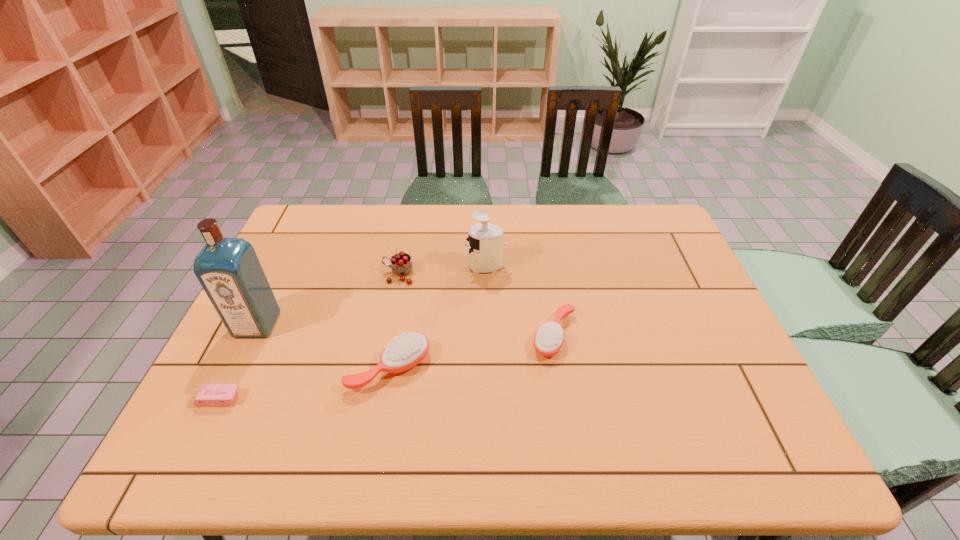
What are the coordinates of `eraser at the left edge` in the screenshot? It's located at (209, 395).

This screenshot has height=540, width=960. What are the coordinates of `object present at the near left corner` in the screenshot? It's located at (209, 395).

In the image, there is a desktop. Identify the location of vacant space at the far edge. (468, 204).

In the image, there is a desktop. Where is `vacant space at the near edge`? Image resolution: width=960 pixels, height=540 pixels. vacant space at the near edge is located at coordinates (623, 413).

Identify the location of blank space at the left edge. (286, 248).

You are a GUI agent. You are given a task and a screenshot of the screen. Output one action in this format:
    pyautogui.click(x=<x>, y=<y>)
    Task: Click on the vacant space at the far left corner
    The image size is (960, 540).
    Given the screenshot: What is the action you would take?
    (x=296, y=234)

At what (x,y) coordinates should I click in order to perform the action: click on vacant space at the near left corner of the desktop. Please return your answer as a coordinate pair (x, y). This screenshot has width=960, height=540. Looking at the image, I should click on (205, 413).

Locate an element on the screen. The width and height of the screenshot is (960, 540). free space at the far right corner of the desktop is located at coordinates (636, 211).

Locate an element on the screen. The width and height of the screenshot is (960, 540). vacant space in between the taller hairbrush and the cherry is located at coordinates (394, 321).

You are a GUI agent. You are given a task and a screenshot of the screen. Output one action in this format:
    pyautogui.click(x=<x>, y=<y>)
    Task: Click on the free space that is in between the shorter hairbrush and the fifth object from left to right
    The image size is (960, 540).
    Given the screenshot: What is the action you would take?
    pyautogui.click(x=520, y=301)